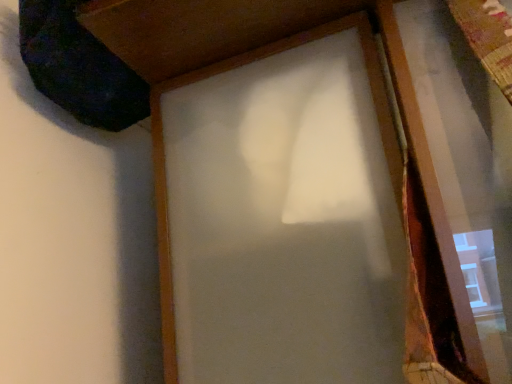
Locate an element on the screen. Image resolution: width=512 pixels, height=384 pixels. wooden frame at right is located at coordinates (459, 170).

What is the approximate width of wooden frame at right?

wooden frame at right is 11.06 centimeters in width.

What do you see at coordinates (459, 170) in the screenshot? I see `wooden frame at right` at bounding box center [459, 170].

Where is `wooden frame at right`? The image size is (512, 384). wooden frame at right is located at coordinates (459, 170).